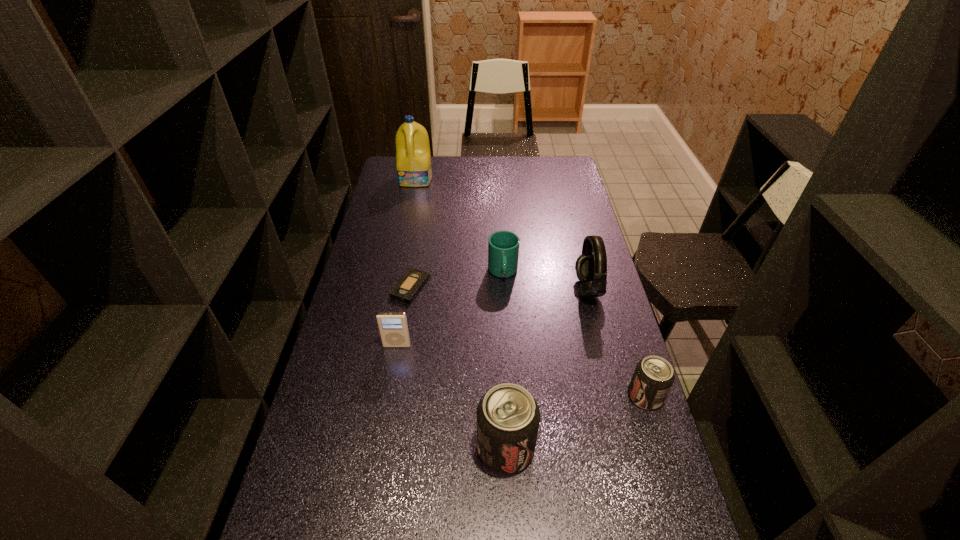
Find the location of a particular element. This screenshot has width=960, height=540. vacant space at the near left corner is located at coordinates (313, 502).

In the image, there is a desktop. In order to click on vacant region at the far right corner in this screenshot , I will do `click(563, 174)`.

Locate an element on the screen. free point between the taller soda can and the cup is located at coordinates (504, 360).

The width and height of the screenshot is (960, 540). Identify the location of blank region between the iPod and the tallest object. (407, 262).

Locate an element on the screen. This screenshot has width=960, height=540. free space between the shorter soda can and the shortest object is located at coordinates (528, 342).

At what (x,y) coordinates should I click in order to perform the action: click on blank region between the headset and the iPod. Please return your answer as a coordinate pair (x, y). Looking at the image, I should click on (492, 317).

The width and height of the screenshot is (960, 540). I want to click on unoccupied position between the shortest object and the headset, so click(x=499, y=288).

The width and height of the screenshot is (960, 540). I want to click on unoccupied position between the nearest object and the right soda can, so click(575, 422).

The height and width of the screenshot is (540, 960). What are the coordinates of `vacant region between the cup and the nearest object` in the screenshot? It's located at (504, 360).

The width and height of the screenshot is (960, 540). In order to click on vacant area between the cup and the detergent in this screenshot , I will do `click(460, 226)`.